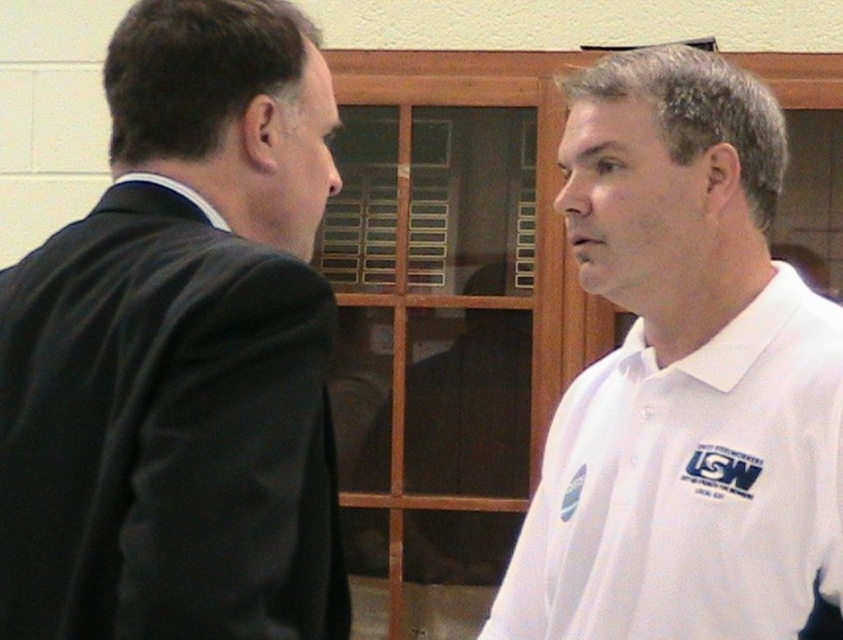
Question: Is black suit at left smaller than white cotton polo shirt at right?

Choices:
 (A) yes
 (B) no

Answer: (A)

Question: In this image, where is black suit at left located relative to white cotton polo shirt at right?

Choices:
 (A) left
 (B) right

Answer: (A)

Question: Is black suit at left to the left of white cotton polo shirt at right from the viewer's perspective?

Choices:
 (A) yes
 (B) no

Answer: (A)